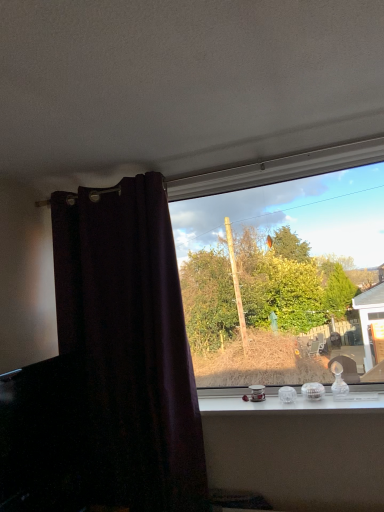
Question: Considering the positions of clear glass ornaments at center and transparent glass window at center in the image, is clear glass ornaments at center taller or shorter than transparent glass window at center?

Choices:
 (A) tall
 (B) short

Answer: (B)

Question: Is clear glass ornaments at center bigger or smaller than transparent glass window at center?

Choices:
 (A) big
 (B) small

Answer: (B)

Question: Which of these objects is positioned closest to the dark purple velvet curtain at left?

Choices:
 (A) transparent glass window at center
 (B) clear glass ornaments at center

Answer: (B)

Question: Estimate the real-world distances between objects in this image. Which object is farther from the transparent glass window at center?

Choices:
 (A) dark purple velvet curtain at left
 (B) clear glass ornaments at center

Answer: (A)